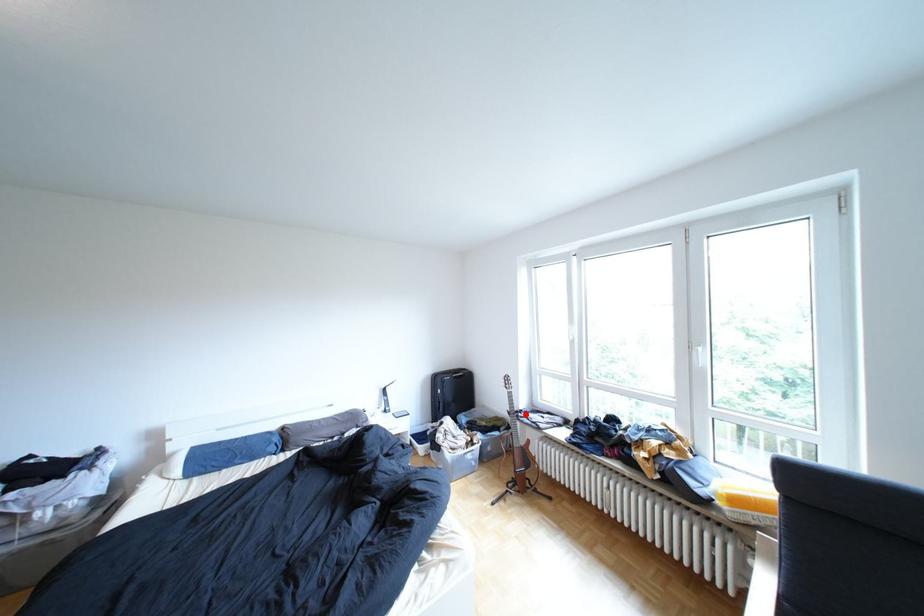
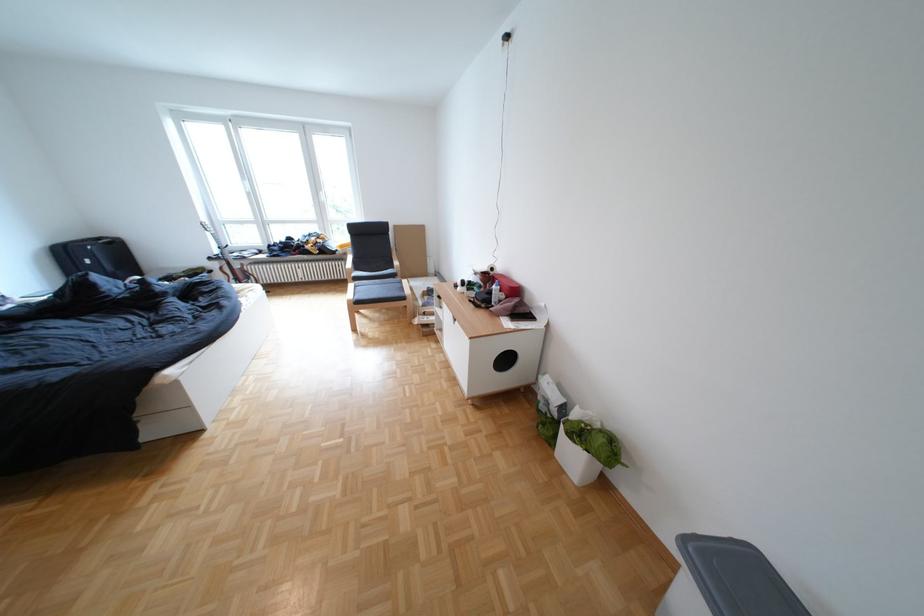
Question: I am providing you with two images of the same scene from different viewpoints. Image1 has a red point marked. In image2, the corresponding 3D location appears at what relative position? Reply with the corresponding letter.

Choices:
 (A) Closer
 (B) Farther

Answer: (A)